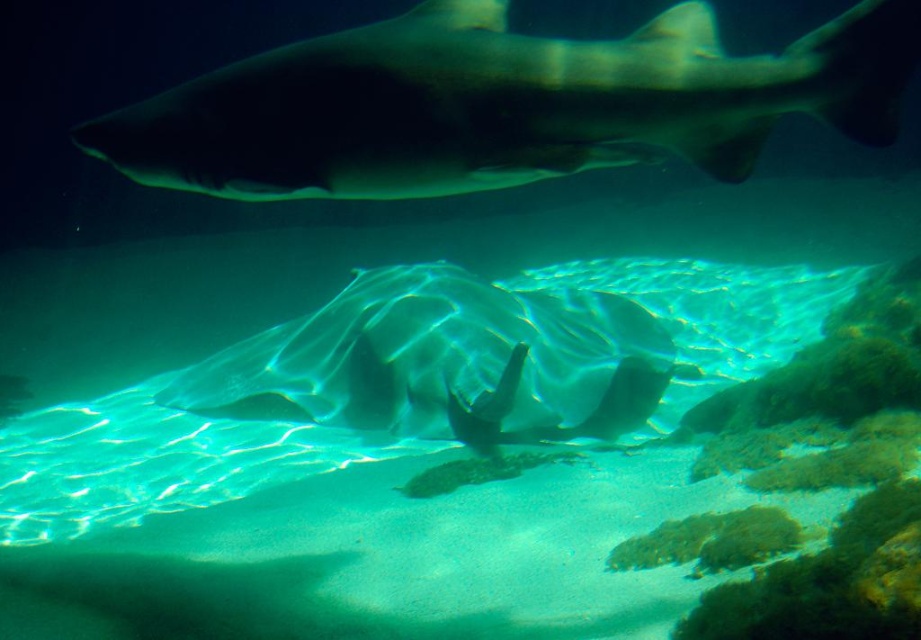
You are a marine biologist observing this underwater scene. You notice the smooth gray shark at upper center and the translucent white shark at center. Which shark is positioned higher in the water column?

The smooth gray shark at upper center is positioned higher in the water column than the translucent white shark at center.

You are a marine biologist observing the underwater scene. You notice the smooth gray shark at upper center and the translucent white shark at center. Which shark appears smaller in height when viewed from above?

The smooth gray shark at upper center is not as tall as the translucent white shark at center, so it appears smaller in height.

You are a marine biologist observing the underwater scene. You notice two sharks, the smooth gray shark at upper center and the translucent white shark at center. Which shark appears narrower in width?

The smooth gray shark at upper center has a lesser width compared to the translucent white shark at center, so it appears narrower in width.